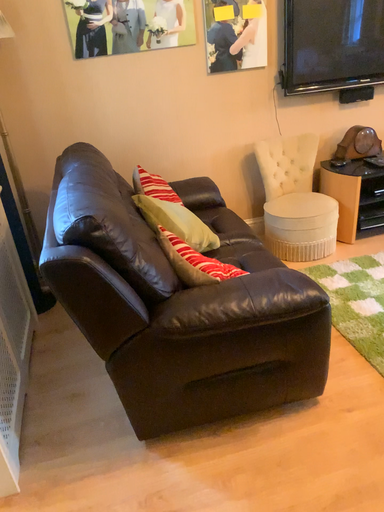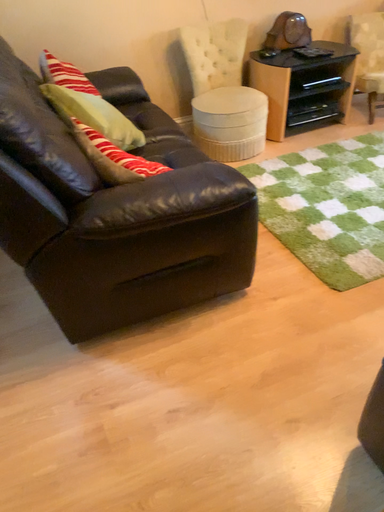
Question: How did the camera likely rotate when shooting the video?

Choices:
 (A) rotated downward
 (B) rotated upward

Answer: (A)